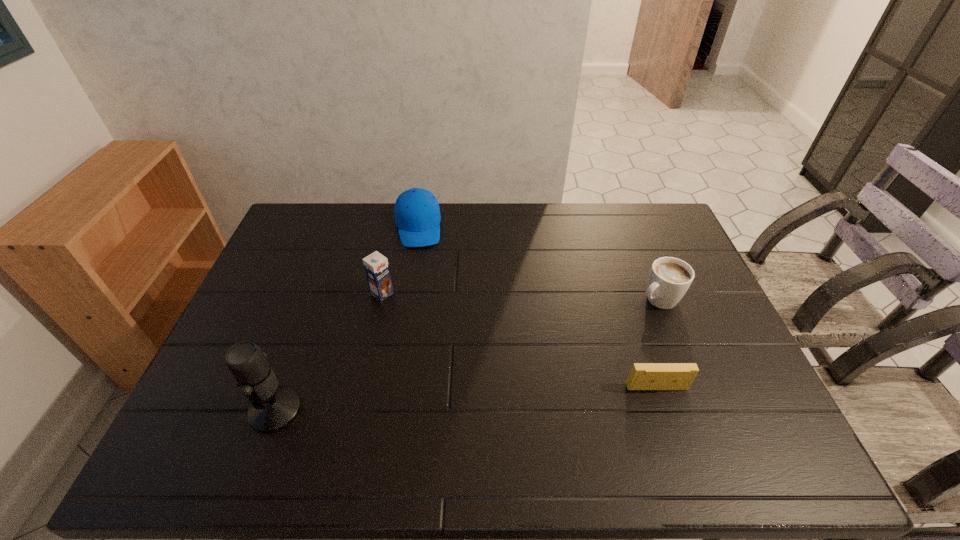
Identify the location of free space located 0.120m on the front label of the fourth shortest object. The width and height of the screenshot is (960, 540). (417, 320).

You are a GUI agent. You are given a task and a screenshot of the screen. Output one action in this format:
    pyautogui.click(x=<x>, y=<y>)
    Task: Click on the vacant space located on the front-facing side of the farthest object
    
    Given the screenshot: What is the action you would take?
    pyautogui.click(x=422, y=288)

Identify the location of vacant area located 0.090m on the front-facing side of the farthest object. (420, 267).

This screenshot has height=540, width=960. I want to click on vacant region located 0.350m on the front-facing side of the farthest object, so click(x=426, y=328).

What are the coordinates of `blank area located with the handle on the side of the cappuccino` in the screenshot? It's located at (614, 325).

You are a GUI agent. You are given a task and a screenshot of the screen. Output one action in this format:
    pyautogui.click(x=<x>, y=<y>)
    Task: Click on the vacant space located with the handle on the side of the cappuccino
    
    Given the screenshot: What is the action you would take?
    pyautogui.click(x=540, y=372)

The image size is (960, 540). Identify the location of vacant region located with the handle on the side of the cappuccino. (565, 355).

The image size is (960, 540). Identify the location of object that is positioned at the far edge. (417, 214).

This screenshot has height=540, width=960. I want to click on microphone situated at the near edge, so click(273, 407).

This screenshot has width=960, height=540. Find the location of `videotape that is at the near edge`. videotape that is at the near edge is located at coordinates (643, 376).